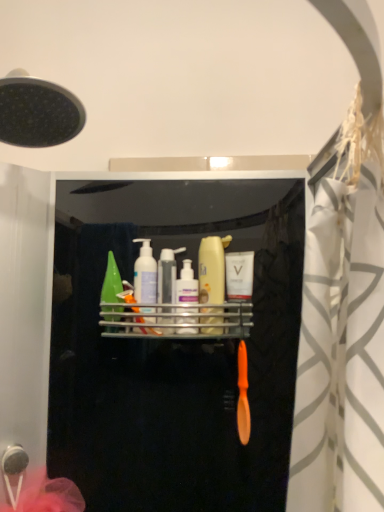
This screenshot has width=384, height=512. Describe the element at coordinates (167, 275) in the screenshot. I see `translucent plastic bottle at center` at that location.

Locate an element on the screen. The height and width of the screenshot is (512, 384). translucent plastic mouthwash at center, positioned as the 2th mouthwash in right-to-left order is located at coordinates (212, 269).

What is the approximate width of translucent plastic mouthwash at center, which appears as the 3th mouthwash when viewed from the right?

translucent plastic mouthwash at center, which appears as the 3th mouthwash when viewed from the right, is 3.88 inches wide.

Describe the element at coordinates (187, 295) in the screenshot. The height and width of the screenshot is (512, 384). I see `translucent plastic mouthwash at center, which appears as the 3th mouthwash when viewed from the right` at that location.

The image size is (384, 512). Describe the element at coordinates (178, 320) in the screenshot. I see `metallic silver shelf at center` at that location.

You are a GUI agent. You are given a task and a screenshot of the screen. Output one action in this format:
    pyautogui.click(x=<x>, y=<y>)
    Task: Click on the translucent plastic bottle at center
    
    Given the screenshot: What is the action you would take?
    pyautogui.click(x=167, y=275)

Is translucent plastic bottle at center at the left side of green plastic bottle at center, acting as the fifth mouthwash starting from the right?

In fact, translucent plastic bottle at center is to the right of green plastic bottle at center, acting as the fifth mouthwash starting from the right.

Between translucent plastic bottle at center and green plastic bottle at center, marked as the 1th mouthwash in a left-to-right arrangement, which one has more height?

With more height is green plastic bottle at center, marked as the 1th mouthwash in a left-to-right arrangement.

Is translucent plastic bottle at center bigger than green plastic bottle at center, marked as the 1th mouthwash in a left-to-right arrangement?

No, translucent plastic bottle at center is not bigger than green plastic bottle at center, marked as the 1th mouthwash in a left-to-right arrangement.

Are translucent plastic bottle at center and green plastic bottle at center, marked as the 1th mouthwash in a left-to-right arrangement, located far from each other?

translucent plastic bottle at center is near green plastic bottle at center, marked as the 1th mouthwash in a left-to-right arrangement, not far away.

Is translucent green bottle at center, the fourth mouthwash in the right-to-left sequence, inside green plastic bottle at center, acting as the fifth mouthwash starting from the right?

Definitely not — translucent green bottle at center, the fourth mouthwash in the right-to-left sequence, is not inside green plastic bottle at center, acting as the fifth mouthwash starting from the right.

Between green plastic bottle at center, marked as the 1th mouthwash in a left-to-right arrangement, and translucent green bottle at center, the fourth mouthwash in the right-to-left sequence, which one is positioned in front?

translucent green bottle at center, the fourth mouthwash in the right-to-left sequence, is closer to the camera.

Considering the sizes of objects green plastic bottle at center, acting as the fifth mouthwash starting from the right, and translucent green bottle at center, marked as the 2th mouthwash in a left-to-right arrangement, in the image provided, who is shorter, green plastic bottle at center, acting as the fifth mouthwash starting from the right, or translucent green bottle at center, marked as the 2th mouthwash in a left-to-right arrangement,?

green plastic bottle at center, acting as the fifth mouthwash starting from the right, is shorter.

What are the coordinates of `the 1st mouthwash to the right when counting from the green plastic bottle at center, marked as the 1th mouthwash in a left-to-right arrangement` in the screenshot? It's located at (145, 274).

Between point (108, 252) and point (126, 329), which one is positioned behind?

The point (108, 252) is more distant.

This screenshot has height=512, width=384. Identify the location of the 4th mouthwash behind when counting from the metallic silver shelf at center. (111, 282).

From a real-world perspective, who is located higher, green plastic bottle at center, acting as the fifth mouthwash starting from the right, or metallic silver shelf at center?

In real-world perspective, green plastic bottle at center, acting as the fifth mouthwash starting from the right, is above.

Does green plastic bottle at center, marked as the 1th mouthwash in a left-to-right arrangement, have a greater width compared to metallic silver shelf at center?

No.

Between white glossy mouthwash at center, placed as the fifth mouthwash when sorted from left to right, and translucent plastic bottle at center, which one appears on the left side from the viewer's perspective?

translucent plastic bottle at center.

Between white glossy mouthwash at center, placed as the fifth mouthwash when sorted from left to right, and translucent plastic bottle at center, which one has more height?

white glossy mouthwash at center, placed as the fifth mouthwash when sorted from left to right.

In the scene shown: Is white glossy mouthwash at center, positioned as the first mouthwash in right-to-left order, oriented towards translucent plastic bottle at center?

No, white glossy mouthwash at center, positioned as the first mouthwash in right-to-left order, is not oriented towards translucent plastic bottle at center.

From a real-world perspective, is white glossy mouthwash at center, placed as the fifth mouthwash when sorted from left to right, positioned above or below translucent plastic bottle at center?

In terms of real-world spatial position, white glossy mouthwash at center, placed as the fifth mouthwash when sorted from left to right, is above translucent plastic bottle at center.

Is metallic silver shelf at center positioned beyond the bounds of translucent plastic bottle at center?

Yes, metallic silver shelf at center is outside of translucent plastic bottle at center.

How many degrees apart are the facing directions of metallic silver shelf at center and translucent plastic bottle at center?

0.00332 degrees separate the facing orientations of metallic silver shelf at center and translucent plastic bottle at center.

Is metallic silver shelf at center shorter than translucent plastic bottle at center?

Yes, metallic silver shelf at center is shorter than translucent plastic bottle at center.

Which is more to the left, metallic silver shelf at center or translucent plastic bottle at center?

translucent plastic bottle at center is more to the left.

Considering the positions of objects translucent green bottle at center, the fourth mouthwash in the right-to-left sequence, and metallic silver shelf at center in the image provided, who is more to the left, translucent green bottle at center, the fourth mouthwash in the right-to-left sequence, or metallic silver shelf at center?

Positioned to the left is translucent green bottle at center, the fourth mouthwash in the right-to-left sequence.

At what (x,y) coordinates should I click in order to perform the action: click on the 3rd mouthwash behind the metallic silver shelf at center, starting your count from the anchor. Please return your answer as a coordinate pair (x, y). The image size is (384, 512). Looking at the image, I should click on (145, 274).

Considering the relative positions of white glossy mouthwash at center, placed as the fifth mouthwash when sorted from left to right, and translucent plastic mouthwash at center, placed as the third mouthwash when sorted from left to right, in the image provided, is white glossy mouthwash at center, placed as the fifth mouthwash when sorted from left to right, to the left of translucent plastic mouthwash at center, placed as the third mouthwash when sorted from left to right, from the viewer's perspective?

In fact, white glossy mouthwash at center, placed as the fifth mouthwash when sorted from left to right, is to the right of translucent plastic mouthwash at center, placed as the third mouthwash when sorted from left to right.

From the image's perspective, which one is positioned lower, white glossy mouthwash at center, positioned as the first mouthwash in right-to-left order, or translucent plastic mouthwash at center, which appears as the 3th mouthwash when viewed from the right?

translucent plastic mouthwash at center, which appears as the 3th mouthwash when viewed from the right, is shown below in the image.

Which is in front, point (248, 312) or point (185, 322)?

The point (185, 322) is closer to the camera.

Locate an element on the screen. This screenshot has height=512, width=384. the 2nd mouthwash counting from the left of the translucent plastic bottle at center is located at coordinates (111, 282).

You are a GUI agent. You are given a task and a screenshot of the screen. Output one action in this format:
    pyautogui.click(x=<x>, y=<y>)
    Task: Click on the mouthwash that is the 1st one when counting forward from the green plastic bottle at center, acting as the fifth mouthwash starting from the right
    This screenshot has width=384, height=512.
    Given the screenshot: What is the action you would take?
    pyautogui.click(x=145, y=274)

When comparing their distances from green plastic bottle at center, marked as the 1th mouthwash in a left-to-right arrangement, does white glossy mouthwash at center, placed as the fifth mouthwash when sorted from left to right, or translucent green bottle at center, marked as the 2th mouthwash in a left-to-right arrangement, seem further?

white glossy mouthwash at center, placed as the fifth mouthwash when sorted from left to right.

Which object lies nearer to the anchor point translucent green bottle at center, the fourth mouthwash in the right-to-left sequence, green plastic bottle at center, marked as the 1th mouthwash in a left-to-right arrangement, or translucent plastic bottle at center?

translucent plastic bottle at center lies closer to translucent green bottle at center, the fourth mouthwash in the right-to-left sequence, than the other object.

Which object lies nearer to the anchor point white glossy mouthwash at center, positioned as the first mouthwash in right-to-left order, translucent plastic bottle at center or metallic silver shelf at center?

Based on the image, metallic silver shelf at center appears to be nearer to white glossy mouthwash at center, positioned as the first mouthwash in right-to-left order.

Looking at the image, which one is located closer to green plastic bottle at center, marked as the 1th mouthwash in a left-to-right arrangement, translucent green bottle at center, the fourth mouthwash in the right-to-left sequence, or white glossy mouthwash at center, positioned as the first mouthwash in right-to-left order?

translucent green bottle at center, the fourth mouthwash in the right-to-left sequence, is closer to green plastic bottle at center, marked as the 1th mouthwash in a left-to-right arrangement.

When comparing their distances from translucent plastic mouthwash at center, placed as the fourth mouthwash when sorted from left to right, does translucent green bottle at center, the fourth mouthwash in the right-to-left sequence, or white glossy mouthwash at center, placed as the fifth mouthwash when sorted from left to right, seem closer?

The object closer to translucent plastic mouthwash at center, placed as the fourth mouthwash when sorted from left to right, is white glossy mouthwash at center, placed as the fifth mouthwash when sorted from left to right.

Which object lies nearer to the anchor point translucent plastic mouthwash at center, which appears as the 3th mouthwash when viewed from the right, translucent plastic bottle at center or green plastic bottle at center, acting as the fifth mouthwash starting from the right?

Based on the image, translucent plastic bottle at center appears to be nearer to translucent plastic mouthwash at center, which appears as the 3th mouthwash when viewed from the right.

Looking at the image, which one is located further to green plastic bottle at center, acting as the fifth mouthwash starting from the right, metallic silver shelf at center or translucent plastic mouthwash at center, placed as the fourth mouthwash when sorted from left to right?

The object further to green plastic bottle at center, acting as the fifth mouthwash starting from the right, is translucent plastic mouthwash at center, placed as the fourth mouthwash when sorted from left to right.

Looking at this image, considering their positions, is white glossy mouthwash at center, positioned as the first mouthwash in right-to-left order, positioned closer to translucent plastic mouthwash at center, placed as the third mouthwash when sorted from left to right, than translucent plastic mouthwash at center, positioned as the 2th mouthwash in right-to-left order?

translucent plastic mouthwash at center, positioned as the 2th mouthwash in right-to-left order, is positioned closer to the anchor translucent plastic mouthwash at center, placed as the third mouthwash when sorted from left to right.

I want to click on mouthwash situated between translucent green bottle at center, the fourth mouthwash in the right-to-left sequence, and translucent plastic mouthwash at center, placed as the fourth mouthwash when sorted from left to right, from left to right, so click(x=187, y=295).

At what (x,y) coordinates should I click in order to perform the action: click on shelf between translucent green bottle at center, marked as the 2th mouthwash in a left-to-right arrangement, and white glossy mouthwash at center, placed as the fifth mouthwash when sorted from left to right, in the horizontal direction. Please return your answer as a coordinate pair (x, y). Looking at the image, I should click on (178, 320).

You are a GUI agent. You are given a task and a screenshot of the screen. Output one action in this format:
    pyautogui.click(x=<x>, y=<y>)
    Task: Click on the shelf between green plastic bottle at center, acting as the fifth mouthwash starting from the right, and translucent plastic mouthwash at center, positioned as the 2th mouthwash in right-to-left order, from left to right
    This screenshot has width=384, height=512.
    Given the screenshot: What is the action you would take?
    pyautogui.click(x=178, y=320)

The width and height of the screenshot is (384, 512). I want to click on mouthwash located between green plastic bottle at center, acting as the fifth mouthwash starting from the right, and translucent plastic mouthwash at center, which appears as the 3th mouthwash when viewed from the right, in the left-right direction, so 145,274.